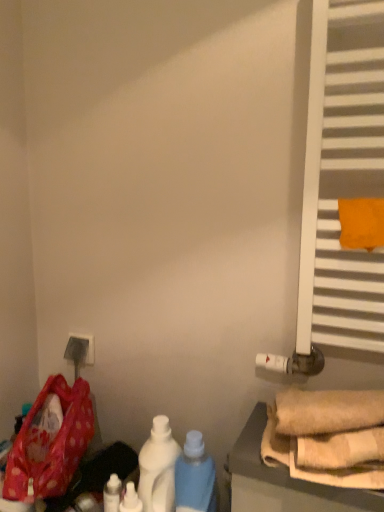
Question: Is the position of orange fabric towel at right less distant than that of white glossy bottle at lower center, placed as the 4th bottle when sorted from left to right?

Choices:
 (A) no
 (B) yes

Answer: (B)

Question: Is orange fabric towel at right touching white glossy bottle at lower center, which is the first bottle from right to left?

Choices:
 (A) no
 (B) yes

Answer: (A)

Question: Does orange fabric towel at right have a larger size compared to white glossy bottle at lower center, placed as the 4th bottle when sorted from left to right?

Choices:
 (A) yes
 (B) no

Answer: (B)

Question: Could you tell me if orange fabric towel at right is facing white glossy bottle at lower center, which is the first bottle from right to left?

Choices:
 (A) yes
 (B) no

Answer: (B)

Question: Does orange fabric towel at right have a lesser height compared to white glossy bottle at lower center, which is the first bottle from right to left?

Choices:
 (A) no
 (B) yes

Answer: (B)

Question: From a real-world perspective, is orange fabric towel at right on top of white glossy bottle at lower center, placed as the 4th bottle when sorted from left to right?

Choices:
 (A) no
 (B) yes

Answer: (B)

Question: Can you confirm if white matte radiator at right is positioned to the left of beige fabric towels at lower right?

Choices:
 (A) no
 (B) yes

Answer: (A)

Question: Is white matte radiator at right taller than beige fabric towels at lower right?

Choices:
 (A) yes
 (B) no

Answer: (A)

Question: From a real-world perspective, is white matte radiator at right over beige fabric towels at lower right?

Choices:
 (A) no
 (B) yes

Answer: (B)

Question: Does white matte radiator at right have a lesser width compared to beige fabric towels at lower right?

Choices:
 (A) yes
 (B) no

Answer: (A)

Question: Does white matte radiator at right have a lesser height compared to beige fabric towels at lower right?

Choices:
 (A) no
 (B) yes

Answer: (A)

Question: From the image's perspective, is white matte radiator at right on beige fabric towels at lower right?

Choices:
 (A) yes
 (B) no

Answer: (A)

Question: From the image's perspective, does polka dot fabric bag at lower left appear lower than white matte radiator at right?

Choices:
 (A) no
 (B) yes

Answer: (B)